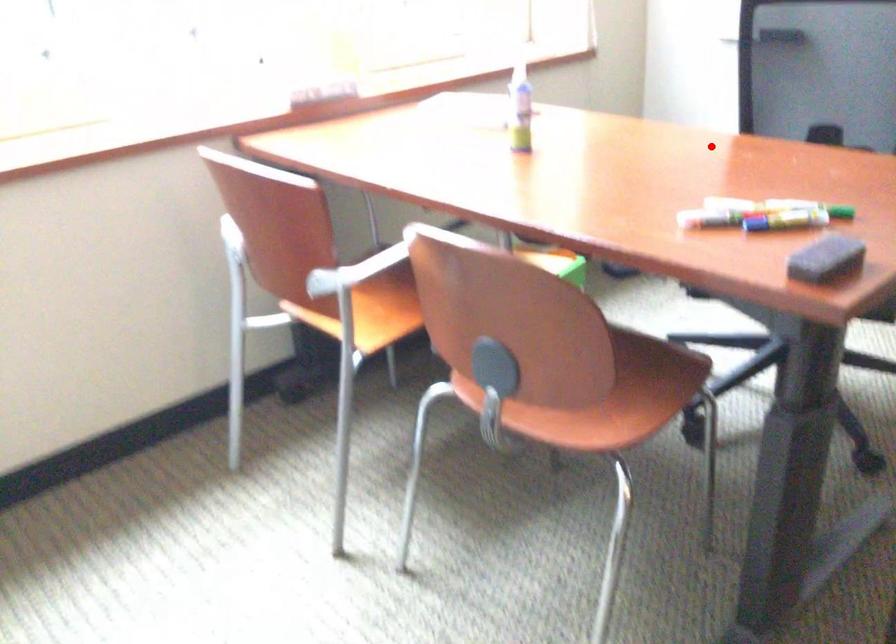
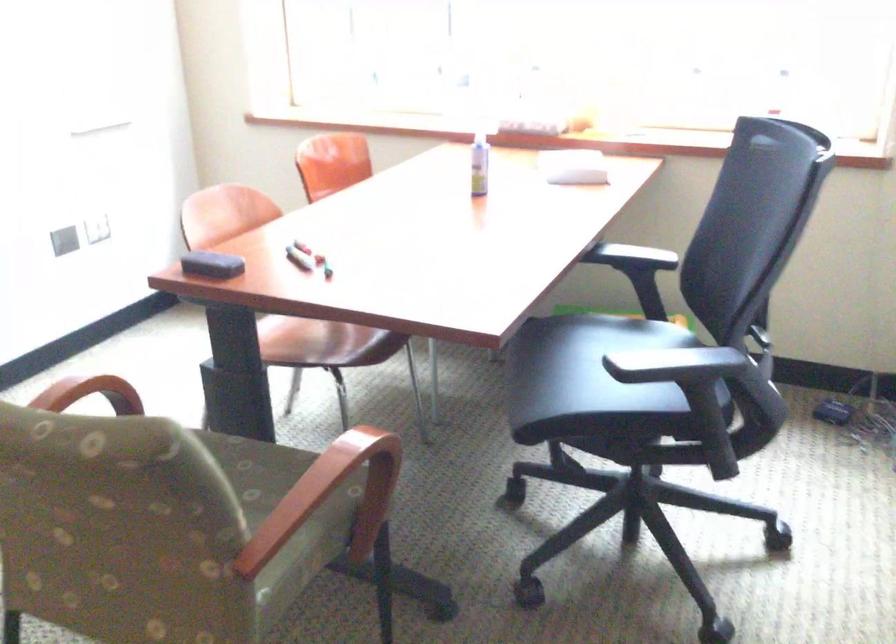
In the second image, find the point that corresponds to the highlighted location in the first image.

(632, 257)